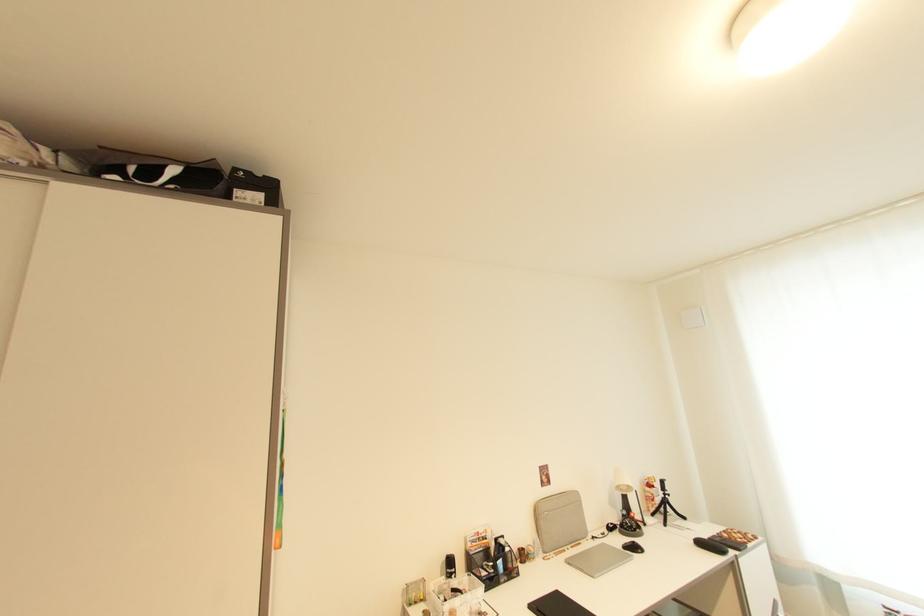
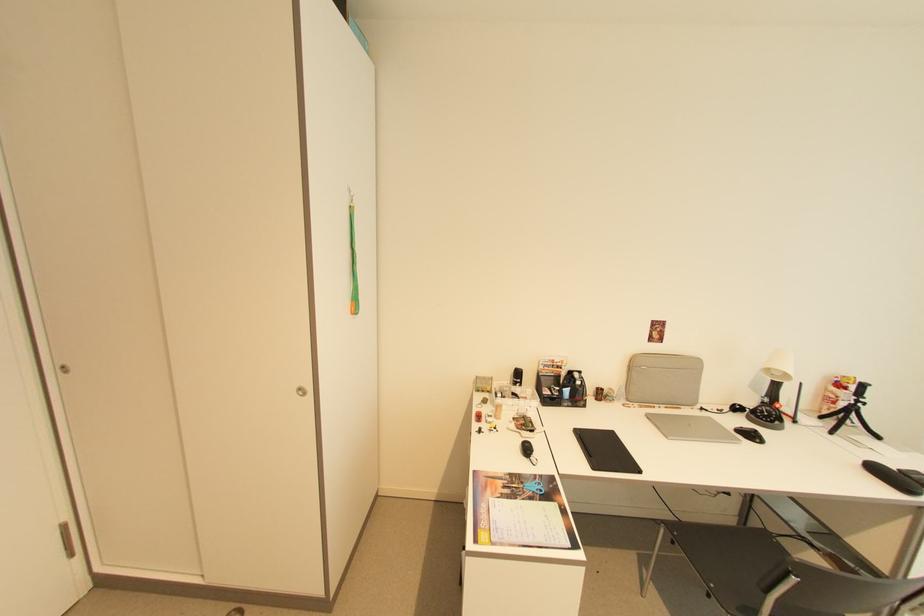
The point at (542, 514) is marked in the first image. Where is the corresponding point in the second image?

(638, 366)